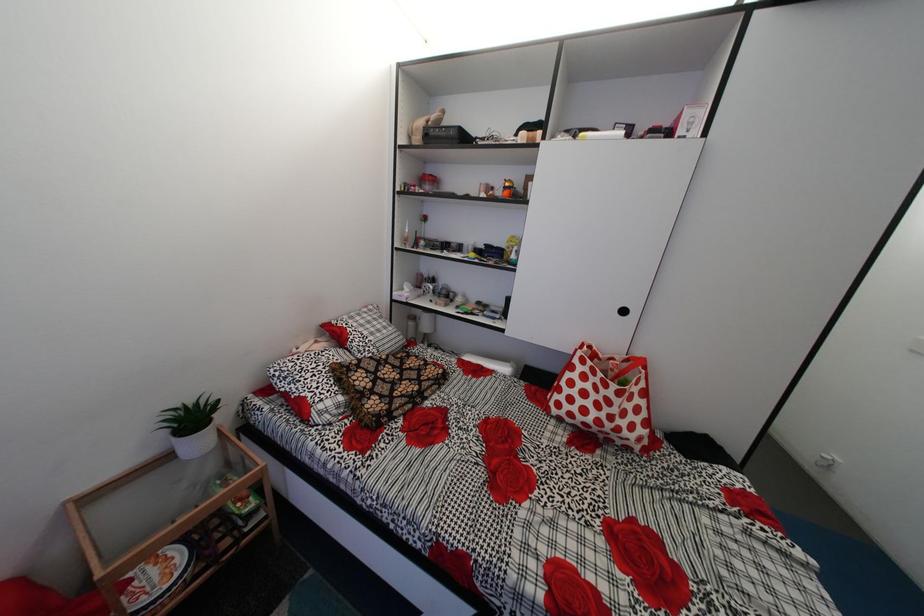
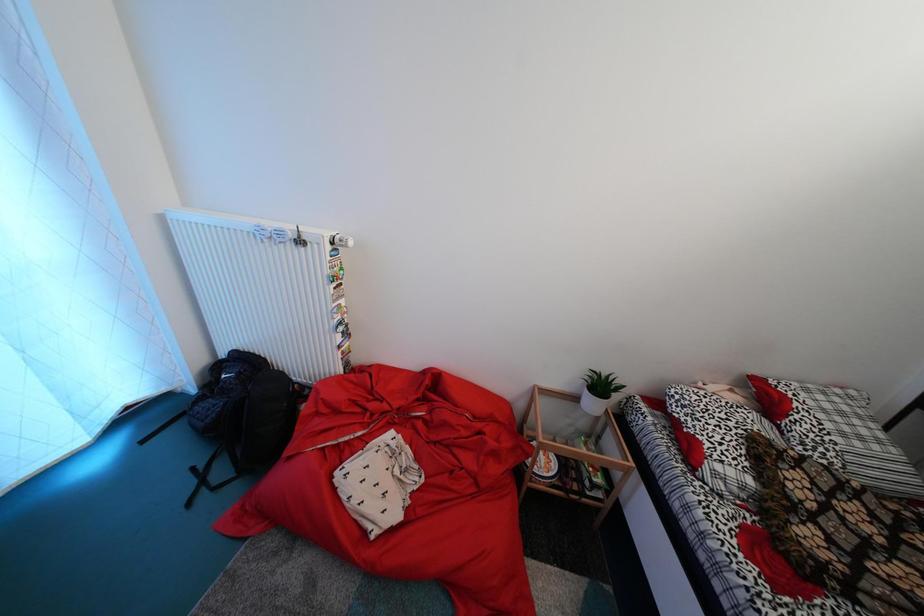
Question: The first image is from the beginning of the video and the second image is from the end. How did the camera likely rotate when shooting the video?

Choices:
 (A) Left
 (B) Right
 (C) Up
 (D) Down

Answer: (A)